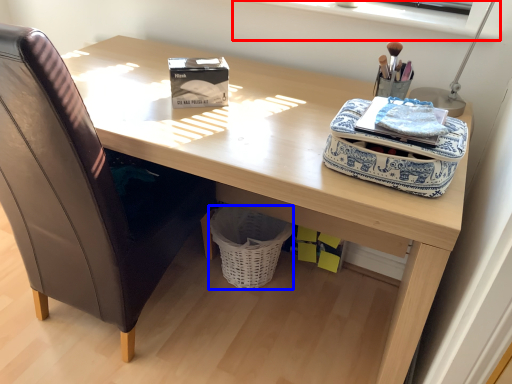
Question: Which object appears farthest to the camera in this image, window sill (highlighted by a red box) or basket (highlighted by a blue box)?

Choices:
 (A) window sill
 (B) basket

Answer: (B)